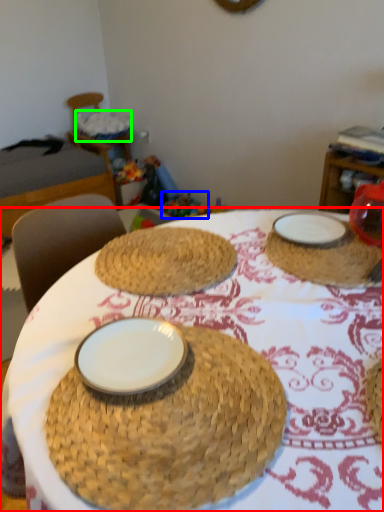
Question: Estimate the real-world distances between objects in this image. Which object is closer to table (highlighted by a red box), toy (highlighted by a blue box) or basket (highlighted by a green box)?

Choices:
 (A) toy
 (B) basket

Answer: (A)